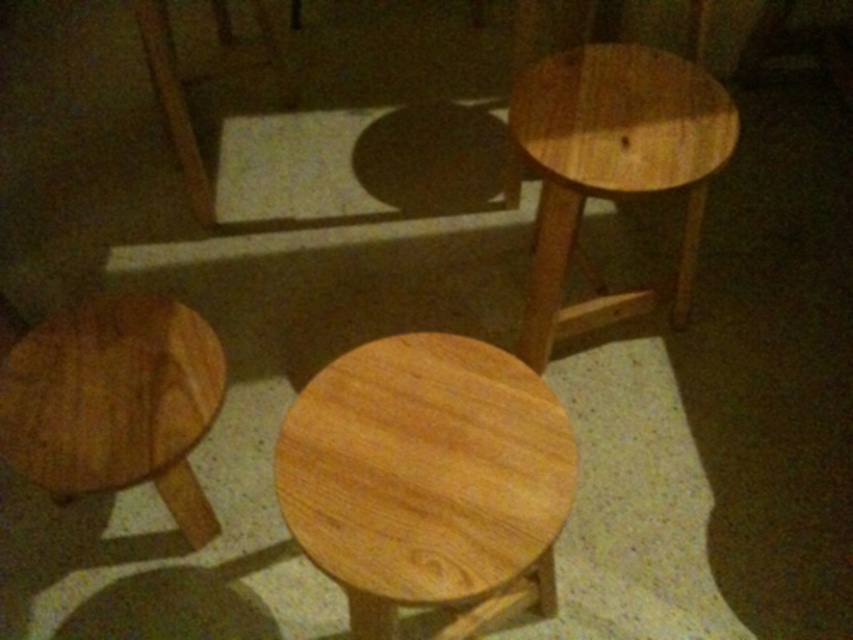
You are standing in front of the three wooden stools arranged in a semi circle on a patterned floor. You see two points marked on the floor, point (386, 609) and point (547, 109). Which point is closer to you?

Point (386, 609) is closer to the camera than point (547, 109), so the point closer to you is point (386, 609).

You are trying to decide which stool to sit on between the natural wood stool at upper right and the natural wood stool at lower left. Based on their sizes, which one might be more comfortable for a taller person?

The natural wood stool at upper right is larger in size than the natural wood stool at lower left, so it might be more comfortable for a taller person.

You are moving a 30 inch wide painting between the natural wood stool at upper right and the natural wood stool at lower left. Can the painting fit through the space between them?

The distance between the natural wood stool at upper right and the natural wood stool at lower left is 29.10 inches. Since the painting is 30 inches wide, it cannot fit through the space between them as the distance is slightly narrower than the painting.